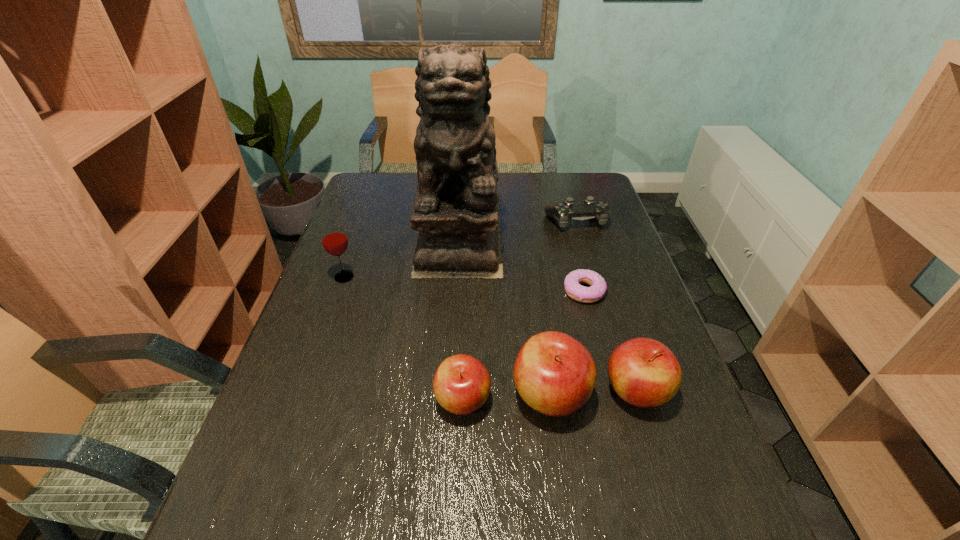
The height and width of the screenshot is (540, 960). In order to click on the shortest apple in this screenshot , I will do `click(461, 385)`.

This screenshot has height=540, width=960. In order to click on the third shortest object in this screenshot , I will do 461,385.

At what (x,y) coordinates should I click in order to perform the action: click on the second apple from right to left. Please return your answer as a coordinate pair (x, y). The width and height of the screenshot is (960, 540). Looking at the image, I should click on (554, 373).

Where is `the fourth shortest object`? the fourth shortest object is located at coordinates (644, 372).

Where is `the rightmost apple`? Image resolution: width=960 pixels, height=540 pixels. the rightmost apple is located at coordinates (644, 372).

Where is `sculpture`? sculpture is located at coordinates (455, 210).

Where is `the shortest object`? This screenshot has height=540, width=960. the shortest object is located at coordinates (574, 290).

Locate an element on the screen. The height and width of the screenshot is (540, 960). the sixth tallest object is located at coordinates (563, 212).

Where is `glass`? This screenshot has height=540, width=960. glass is located at coordinates (334, 240).

Find the location of `vacant area situated 0.340m on the back of the leftmost apple`. vacant area situated 0.340m on the back of the leftmost apple is located at coordinates (467, 280).